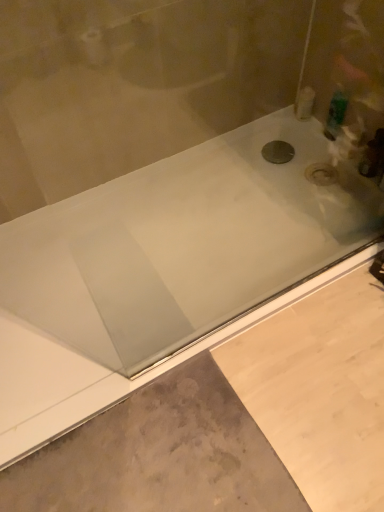
Question: Can you confirm if white plastic bottle at upper right, arranged as the second toiletry when viewed from the right, is thinner than black metallic drain at center?

Choices:
 (A) no
 (B) yes

Answer: (B)

Question: Is white plastic bottle at upper right, arranged as the second toiletry when viewed from the right, positioned beyond the bounds of black metallic drain at center?

Choices:
 (A) yes
 (B) no

Answer: (A)

Question: Considering the relative positions of white plastic bottle at upper right, arranged as the first toiletry when viewed from the left, and black metallic drain at center in the image provided, is white plastic bottle at upper right, arranged as the first toiletry when viewed from the left, to the right of black metallic drain at center from the viewer's perspective?

Choices:
 (A) no
 (B) yes

Answer: (B)

Question: Considering the relative positions of white plastic bottle at upper right, arranged as the second toiletry when viewed from the right, and black metallic drain at center in the image provided, is white plastic bottle at upper right, arranged as the second toiletry when viewed from the right, to the left of black metallic drain at center from the viewer's perspective?

Choices:
 (A) no
 (B) yes

Answer: (A)

Question: Is white plastic bottle at upper right, arranged as the second toiletry when viewed from the right, positioned in front of black metallic drain at center?

Choices:
 (A) no
 (B) yes

Answer: (A)

Question: Is gray concrete at lower left in front of or behind green plastic bottle at upper right, which is counted as the 2th toiletry, starting from the left, in the image?

Choices:
 (A) behind
 (B) front

Answer: (B)

Question: In terms of width, does gray concrete at lower left look wider or thinner when compared to green plastic bottle at upper right, which is counted as the 2th toiletry, starting from the left?

Choices:
 (A) thin
 (B) wide

Answer: (B)

Question: Choose the correct answer: Is gray concrete at lower left inside green plastic bottle at upper right, which is counted as the 2th toiletry, starting from the left, or outside it?

Choices:
 (A) inside
 (B) outside

Answer: (B)

Question: In the image, is gray concrete at lower left on the left side or the right side of green plastic bottle at upper right, which is counted as the 2th toiletry, starting from the left?

Choices:
 (A) left
 (B) right

Answer: (A)

Question: Considering their positions, is white plastic bottle at upper right, arranged as the first toiletry when viewed from the left, located in front of or behind green plastic bottle at upper right, which is the first toiletry in right-to-left order?

Choices:
 (A) front
 (B) behind

Answer: (B)

Question: Considering the positions of white plastic bottle at upper right, arranged as the second toiletry when viewed from the right, and green plastic bottle at upper right, which is counted as the 2th toiletry, starting from the left, in the image, is white plastic bottle at upper right, arranged as the second toiletry when viewed from the right, wider or thinner than green plastic bottle at upper right, which is counted as the 2th toiletry, starting from the left,?

Choices:
 (A) wide
 (B) thin

Answer: (A)

Question: Is white plastic bottle at upper right, arranged as the second toiletry when viewed from the right, inside the boundaries of green plastic bottle at upper right, which is the first toiletry in right-to-left order, or outside?

Choices:
 (A) inside
 (B) outside

Answer: (B)

Question: From a real-world perspective, relative to green plastic bottle at upper right, which is counted as the 2th toiletry, starting from the left, is white plastic bottle at upper right, arranged as the second toiletry when viewed from the right, vertically above or below?

Choices:
 (A) below
 (B) above

Answer: (A)

Question: Does point (342, 111) appear closer or farther from the camera than point (291, 148)?

Choices:
 (A) farther
 (B) closer

Answer: (B)

Question: From a real-world perspective, is green plastic bottle at upper right, which is the first toiletry in right-to-left order, positioned above or below black metallic drain at center?

Choices:
 (A) above
 (B) below

Answer: (A)